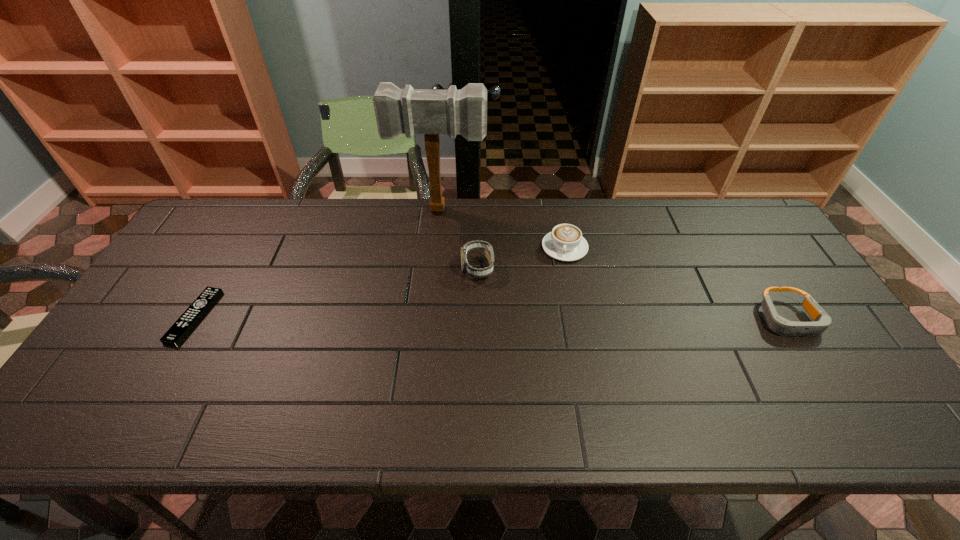
Find the location of a particular element. This screenshot has height=540, width=960. object that can be found as the closest to the remote control is located at coordinates 431,112.

You are a GUI agent. You are given a task and a screenshot of the screen. Output one action in this format:
    pyautogui.click(x=<x>, y=<y>)
    Task: Click on the free region that satisfies the following two spatial constraints: 1. on the back side of the watch; 2. on the left side of the shortest object
    
    Given the screenshot: What is the action you would take?
    pyautogui.click(x=223, y=267)